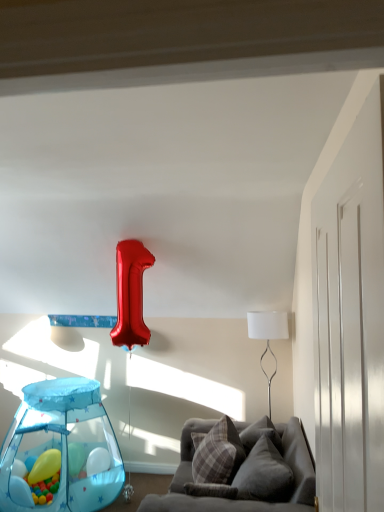
Question: Considering the relative sizes of white fabric lampshade at upper right and plaid fabric pillow at center, arranged as the second pillow when viewed from the front, in the image provided, is white fabric lampshade at upper right taller than plaid fabric pillow at center, arranged as the second pillow when viewed from the front,?

Choices:
 (A) no
 (B) yes

Answer: (B)

Question: From a real-world perspective, is white fabric lampshade at upper right located higher than plaid fabric pillow at center, arranged as the second pillow when viewed from the front?

Choices:
 (A) no
 (B) yes

Answer: (B)

Question: Is white fabric lampshade at upper right not within plaid fabric pillow at center, arranged as the second pillow when viewed from the front?

Choices:
 (A) no
 (B) yes

Answer: (B)

Question: Is white fabric lampshade at upper right wider than plaid fabric pillow at center, placed as the 1th pillow when sorted from back to front?

Choices:
 (A) yes
 (B) no

Answer: (A)

Question: Is white fabric lampshade at upper right positioned with its back to plaid fabric pillow at center, placed as the 1th pillow when sorted from back to front?

Choices:
 (A) no
 (B) yes

Answer: (A)

Question: Looking at the image, does rubber yellow ball at lower left, the 2th balloon when ordered from front to back, seem bigger or smaller compared to translucent plastic play tent at lower left?

Choices:
 (A) big
 (B) small

Answer: (B)

Question: In the image, is rubber yellow ball at lower left, the 2th balloon when ordered from front to back, positioned in front of or behind translucent plastic play tent at lower left?

Choices:
 (A) front
 (B) behind

Answer: (B)

Question: Is rubber yellow ball at lower left, the 2th balloon when ordered from front to back, situated inside translucent plastic play tent at lower left or outside?

Choices:
 (A) inside
 (B) outside

Answer: (A)

Question: Considering the relative positions of rubber yellow ball at lower left, the 2th balloon when ordered from front to back, and translucent plastic play tent at lower left in the image provided, is rubber yellow ball at lower left, the 2th balloon when ordered from front to back, to the left or to the right of translucent plastic play tent at lower left?

Choices:
 (A) left
 (B) right

Answer: (A)

Question: Visually, is velvet gray couch at lower right positioned to the left or to the right of rubber yellow ball at lower left, the 2th balloon when ordered from front to back?

Choices:
 (A) right
 (B) left

Answer: (A)

Question: From their relative heights in the image, would you say velvet gray couch at lower right is taller or shorter than rubber yellow ball at lower left, positioned as the 1th balloon in back-to-front order?

Choices:
 (A) tall
 (B) short

Answer: (A)

Question: Is point click(180, 487) closer or farther from the camera than point click(51, 471)?

Choices:
 (A) closer
 (B) farther

Answer: (A)

Question: Considering their positions, is velvet gray couch at lower right located in front of or behind rubber yellow ball at lower left, the 2th balloon when ordered from front to back?

Choices:
 (A) behind
 (B) front

Answer: (B)

Question: Is velvet gray couch at lower right in front of or behind plaid fabric pillow at center, arranged as the second pillow when viewed from the front, in the image?

Choices:
 (A) behind
 (B) front

Answer: (B)

Question: Considering the positions of velvet gray couch at lower right and plaid fabric pillow at center, arranged as the second pillow when viewed from the front, in the image, is velvet gray couch at lower right bigger or smaller than plaid fabric pillow at center, arranged as the second pillow when viewed from the front,?

Choices:
 (A) small
 (B) big

Answer: (B)